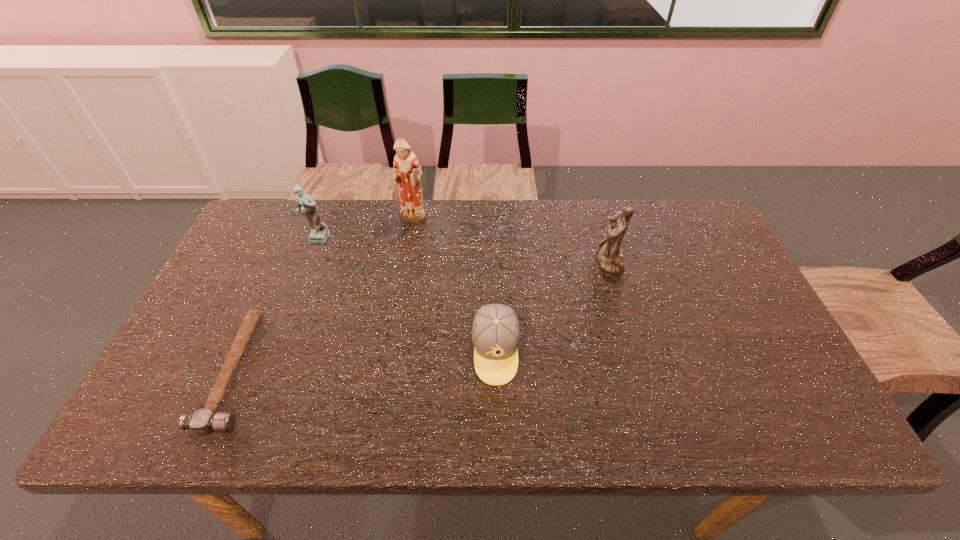
Locate an element on the screen. Image resolution: width=960 pixels, height=540 pixels. vacant area that lies between the leftmost figurine and the second object from right to left is located at coordinates (406, 296).

The image size is (960, 540). In order to click on object that is the second nearest to the shortest object in this screenshot , I will do `click(407, 171)`.

The image size is (960, 540). In order to click on the fourth closest object to the hammer in this screenshot , I will do `click(609, 257)`.

Where is `figurine that is the second closest one to the leftmost figurine`? The image size is (960, 540). figurine that is the second closest one to the leftmost figurine is located at coordinates (609, 257).

Where is `figurine that is the second closest to the fourth object from left to right`? The height and width of the screenshot is (540, 960). figurine that is the second closest to the fourth object from left to right is located at coordinates tap(407, 171).

What are the coordinates of `vacant space that satisfies the following two spatial constraints: 1. on the front-facing side of the leftmost figurine; 2. on the striking face of the shortest object` in the screenshot? It's located at (267, 370).

Where is `vacant space that satisfies the following two spatial constraints: 1. on the front-facing side of the leftmost figurine; 2. on the striking face of the shortest object`? vacant space that satisfies the following two spatial constraints: 1. on the front-facing side of the leftmost figurine; 2. on the striking face of the shortest object is located at coordinates (267, 370).

You are a GUI agent. You are given a task and a screenshot of the screen. Output one action in this format:
    pyautogui.click(x=<x>, y=<y>)
    Task: Click on the vacant space that satisfies the following two spatial constraints: 1. on the front-facing side of the leftmost figurine; 2. on the striking face of the hammer
    The height and width of the screenshot is (540, 960).
    Given the screenshot: What is the action you would take?
    pyautogui.click(x=267, y=370)

Where is `blank area in the image that satisfies the following two spatial constraints: 1. on the front-facing side of the leftmost figurine; 2. on the striking face of the hammer`? The height and width of the screenshot is (540, 960). blank area in the image that satisfies the following two spatial constraints: 1. on the front-facing side of the leftmost figurine; 2. on the striking face of the hammer is located at coordinates (267, 370).

Where is `vacant space that satisfies the following two spatial constraints: 1. on the front-facing side of the rightmost figurine; 2. on the front-facing side of the second object from right to left`? vacant space that satisfies the following two spatial constraints: 1. on the front-facing side of the rightmost figurine; 2. on the front-facing side of the second object from right to left is located at coordinates (636, 352).